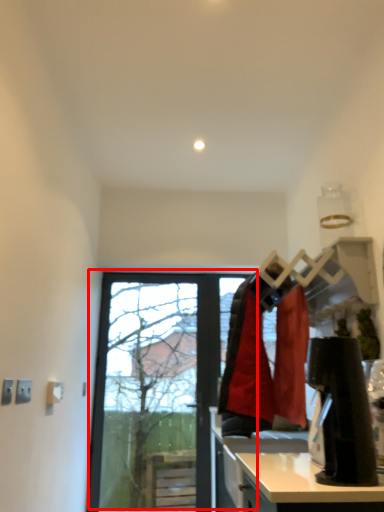
Question: From the image's perspective, where is window (annotated by the red box) located relative to counter top?

Choices:
 (A) below
 (B) above

Answer: (B)